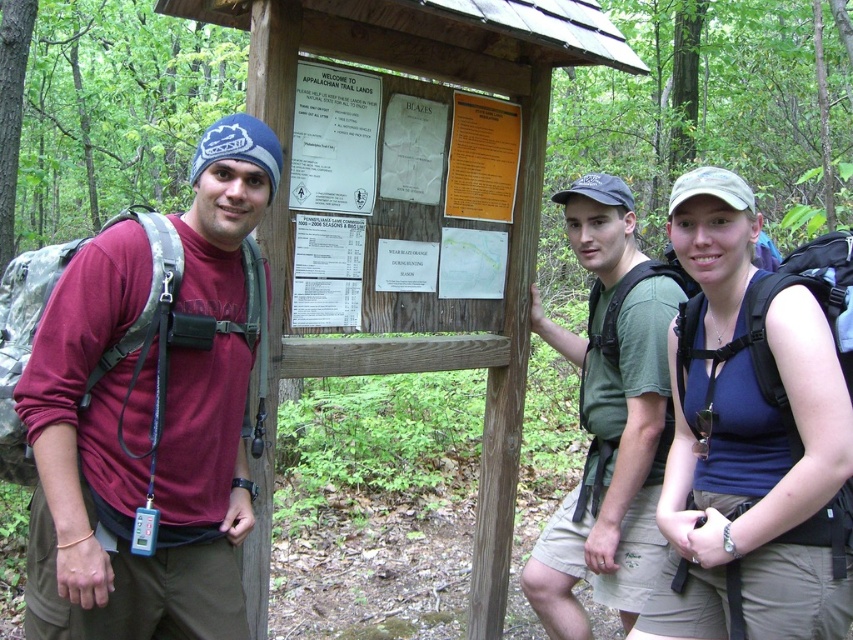
Question: Does maroon fabric shirt at left appear on the right side of blue fabric shirt at center?

Choices:
 (A) yes
 (B) no

Answer: (B)

Question: Which object appears closest to the camera in this image?

Choices:
 (A) blue fabric shirt at center
 (B) maroon fabric shirt at left
 (C) green fabric shirt at center

Answer: (B)

Question: Does blue fabric shirt at center appear on the left side of green fabric shirt at center?

Choices:
 (A) yes
 (B) no

Answer: (B)

Question: Which of the following is the closest to the observer?

Choices:
 (A) blue fabric shirt at center
 (B) green fabric shirt at center

Answer: (A)

Question: Does maroon fabric shirt at left appear under blue fabric shirt at center?

Choices:
 (A) yes
 (B) no

Answer: (B)

Question: Which point is closer to the camera?

Choices:
 (A) (172, 561)
 (B) (730, 259)

Answer: (B)